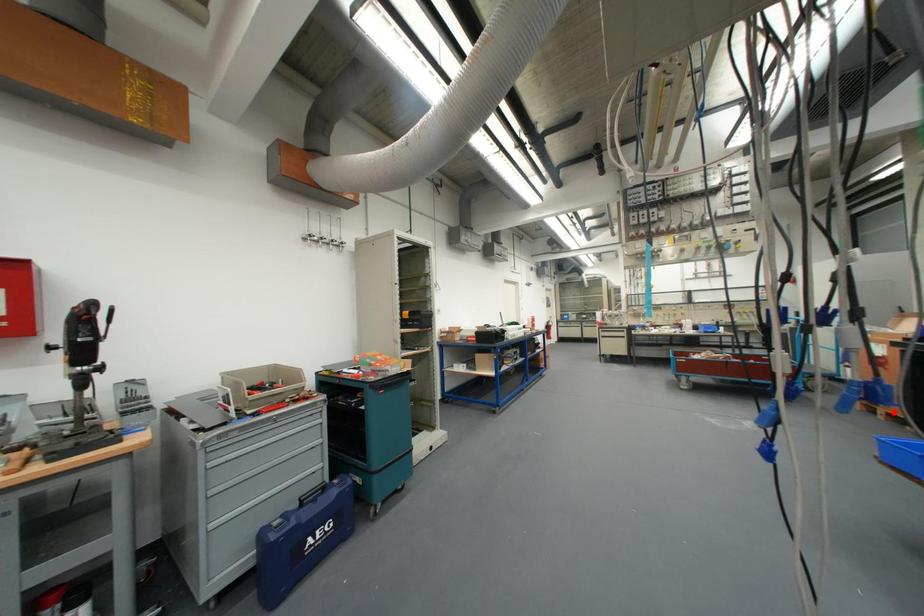
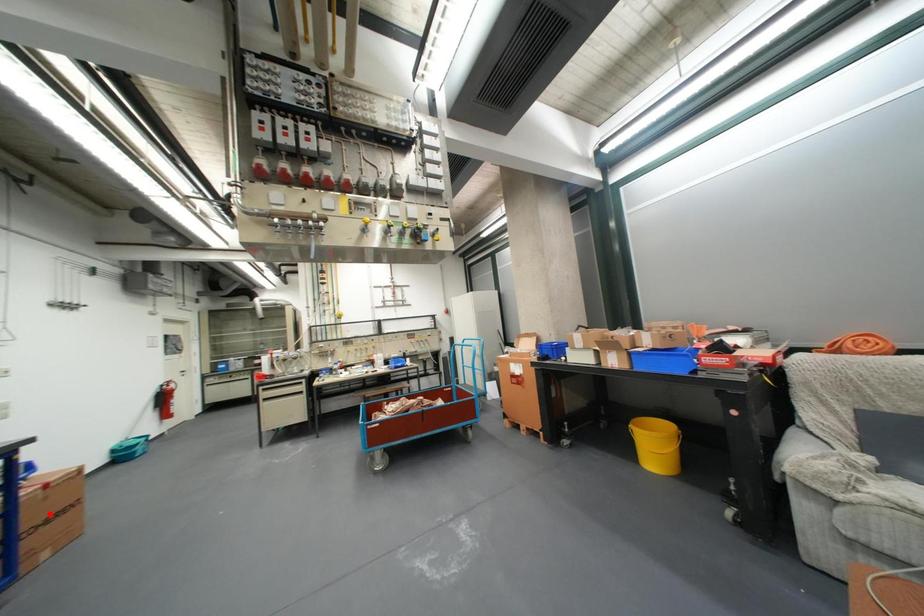
I am providing you with two images of the same scene from different viewpoints. A red point is marked on the first image and another point is marked on the second image. Is the red point in image1 aligned with the point shown in image2?

No